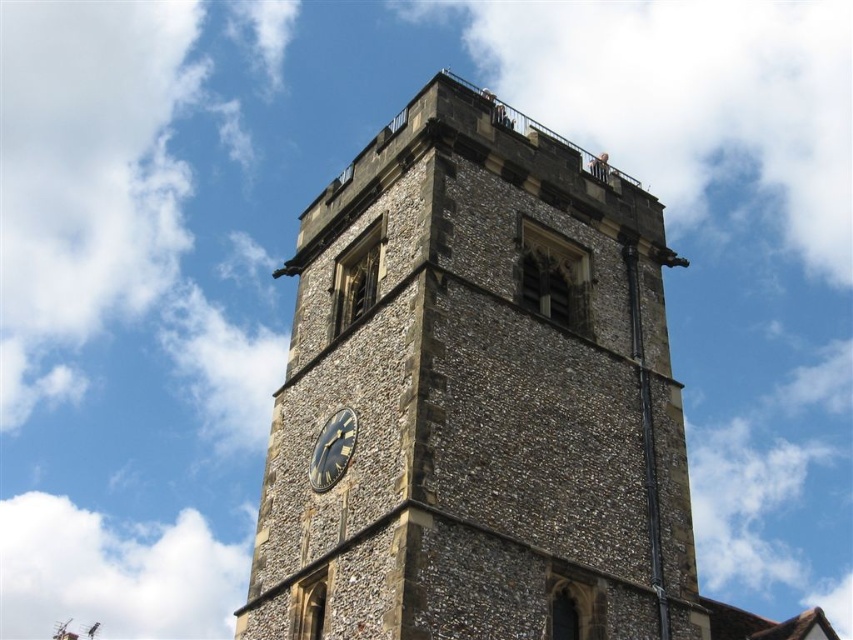
You are a window cleaner with a ladder that is 3 meters long. You need to clean both the brown stone clock tower at upper center and the black stone clock at center. Can your ladder reach both objects if you place it at the base of the tower?

The brown stone clock tower at upper center and the black stone clock at center are 2.81 meters apart from each other. Since your ladder is 3 meters long, it can reach both objects as the distance between them is less than the ladder length.

You are standing at the base of the brown stone clock tower at upper center. Looking up, you notice a point marked at coordinates (x=477, y=397). Where is this point located on the tower?

The point at coordinates (x=477, y=397) is located at the brown stone clock tower at upper center.

You are a bird flying near the brown stone clock tower at upper center and the black stone clock at center. Which structure is higher up in the sky?

The brown stone clock tower at upper center is located above the black stone clock at center, so the brown stone clock tower at upper center is higher up in the sky.